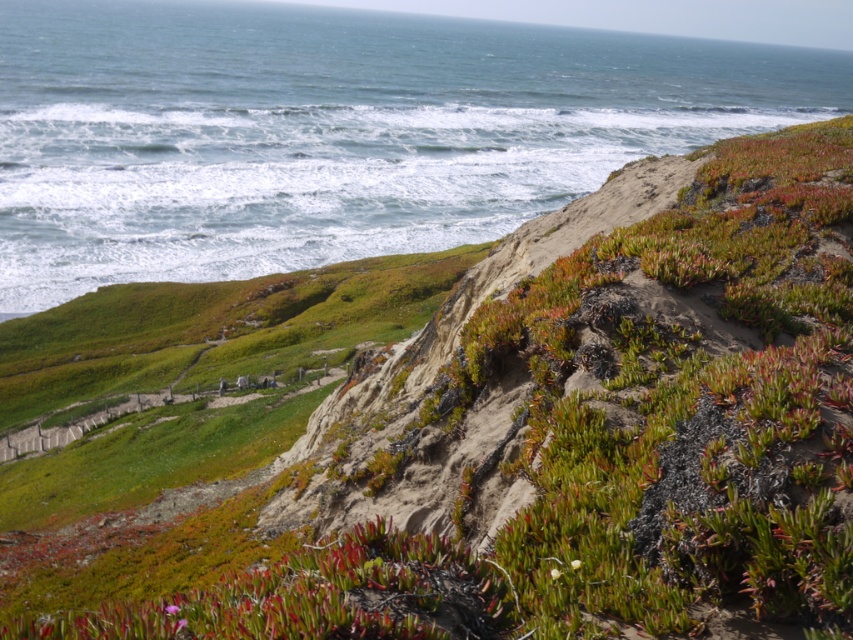
Question: Does blue water at upper left appear on the right side of green matte flower at upper center?

Choices:
 (A) no
 (B) yes

Answer: (A)

Question: Is blue water at upper left thinner than green succulent at center?

Choices:
 (A) yes
 (B) no

Answer: (B)

Question: Does vivid pink petals at center have a smaller size compared to green succulent at lower left?

Choices:
 (A) yes
 (B) no

Answer: (B)

Question: Estimate the real-world distances between objects in this image. Which object is closer to the vivid pink petals at center?

Choices:
 (A) green succulent at center
 (B) blue water at upper left

Answer: (A)

Question: Which point is farther to the camera?

Choices:
 (A) (177, 632)
 (B) (287, 128)
 (C) (572, 564)

Answer: (B)

Question: Which of the following is the closest to the observer?

Choices:
 (A) (579, 564)
 (B) (105, 236)
 (C) (177, 621)
 (D) (550, 570)

Answer: (C)